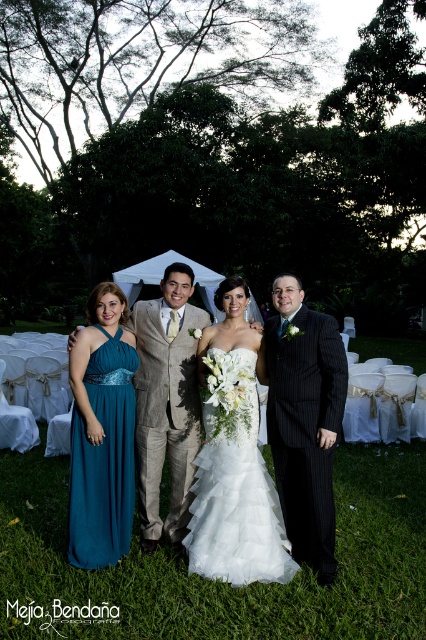
You are a photographer setting up for a group photo. You have two dresses in the frame, the white tulle dress at center and the teal chiffon dress at left. Based on their positions, which dress do you think has a wider silhouette?

The white tulle dress at center might be wider than teal chiffon dress at left according to the description.

You are standing in the wedding scene and want to place a small bouquet between the two points marked as point (218, 564) and point (123, 550). Which point should the bouquet be closer to in order to appear closer to the foreground?

The bouquet should be placed closer to point (218, 564) because it is closer to the viewer than point (123, 550).